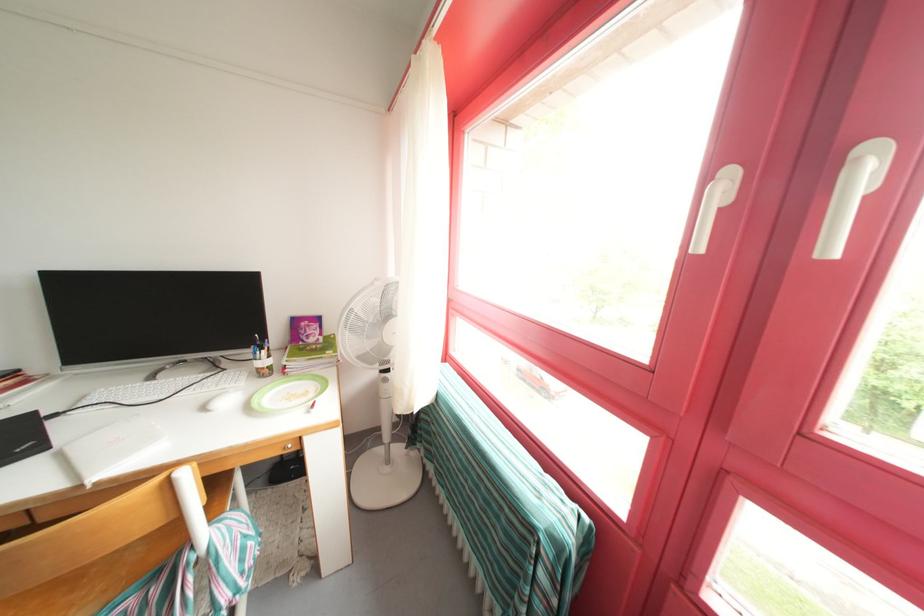
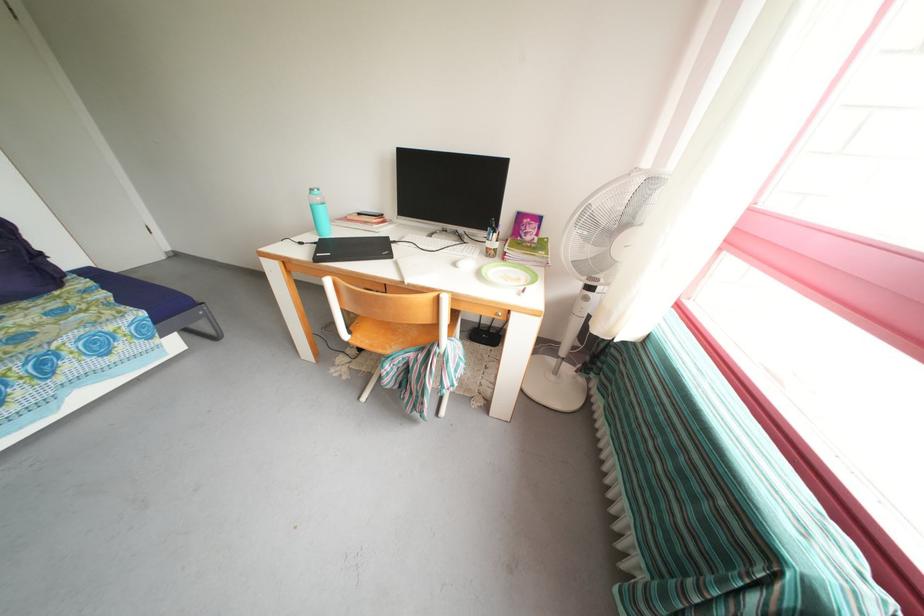
Where in the second image is the point corresponding to the point at 159,383 from the first image?

(436, 241)